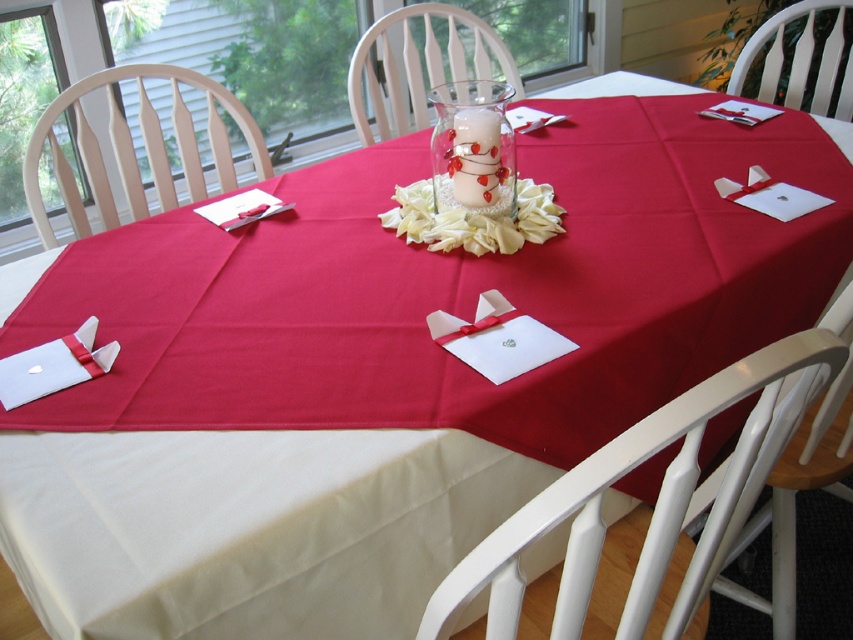
Question: Is clear glass vase at center above white fabric flower at center?

Choices:
 (A) no
 (B) yes

Answer: (B)

Question: Which object appears farthest from the camera in this image?

Choices:
 (A) clear glass vase at center
 (B) white fabric flower at center

Answer: (B)

Question: Is clear glass vase at center to the right of white fabric flower at center from the viewer's perspective?

Choices:
 (A) no
 (B) yes

Answer: (A)

Question: Which point is closer to the camera taking this photo?

Choices:
 (A) (467, 244)
 (B) (508, 189)

Answer: (A)

Question: Does clear glass vase at center appear on the right side of white fabric flower at center?

Choices:
 (A) no
 (B) yes

Answer: (A)